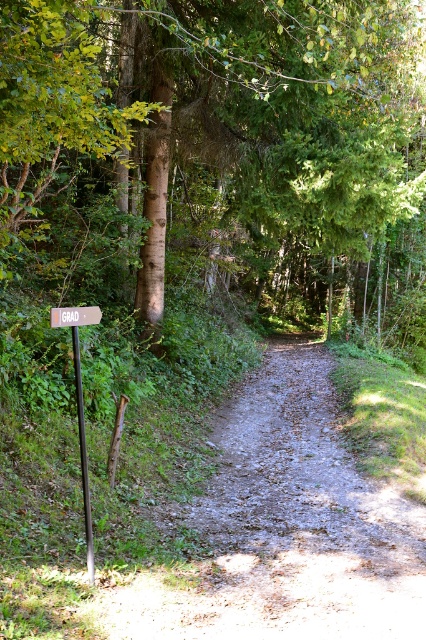
Question: Is wooden sign at center below brown rough wooden post at left?

Choices:
 (A) no
 (B) yes

Answer: (A)

Question: Which object is closer to the camera taking this photo?

Choices:
 (A) wooden sign at center
 (B) orange wooden signpost at left
 (C) brown textured tree at left

Answer: (C)

Question: Does brown textured tree at left have a smaller size compared to orange wooden signpost at left?

Choices:
 (A) no
 (B) yes

Answer: (A)

Question: Which of the following is the closest to the observer?

Choices:
 (A) wooden sign at center
 (B) brown textured tree at left
 (C) brown rough wooden post at left
 (D) orange wooden signpost at left

Answer: (B)

Question: Can you confirm if orange wooden signpost at left is positioned below brown rough wooden post at left?

Choices:
 (A) yes
 (B) no

Answer: (B)

Question: Based on their relative distances, which object is farther from the wooden sign at center?

Choices:
 (A) orange wooden signpost at left
 (B) brown rough wooden post at left

Answer: (B)